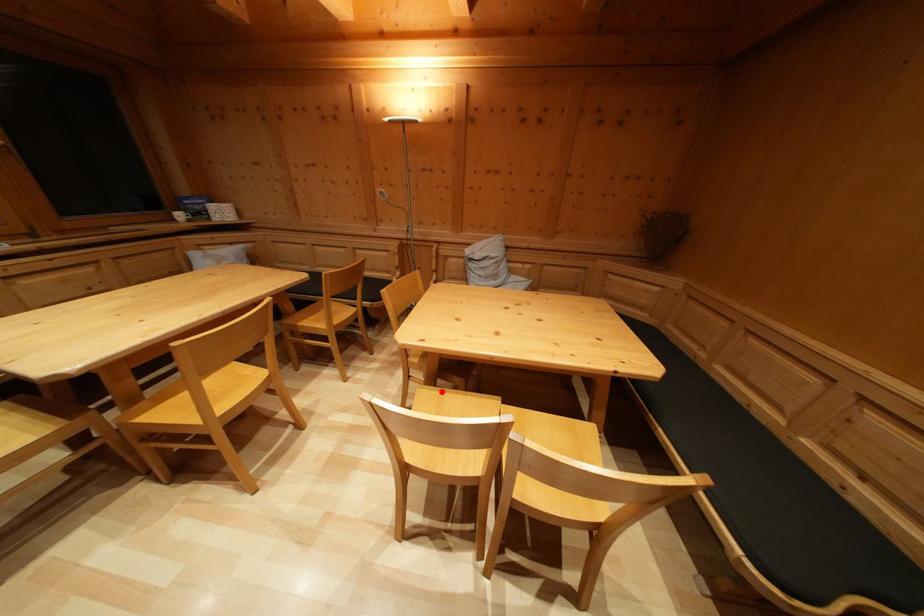
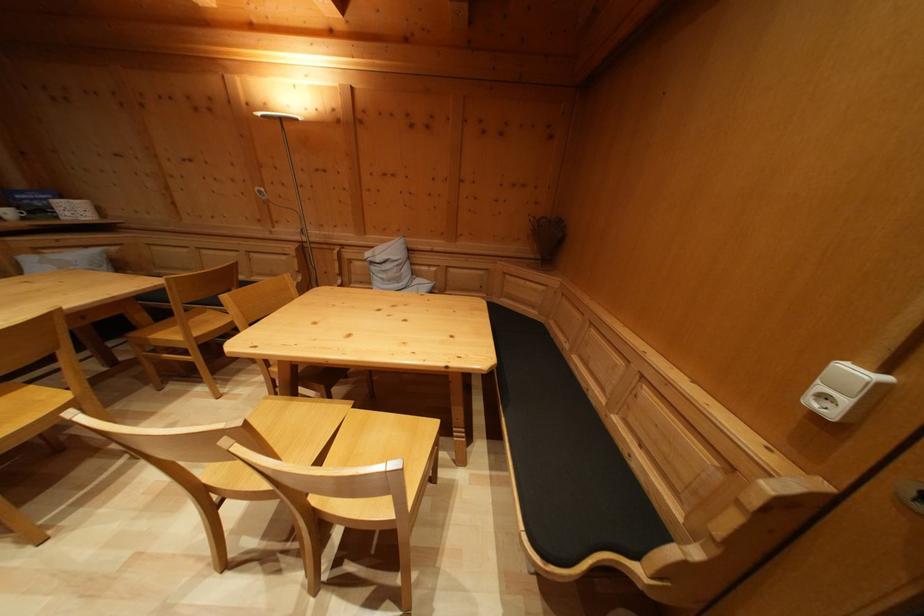
Question: I am providing you with two images of the same scene from different viewpoints. Image1 has a red point marked. In image2, the corresponding 3D location appears at what relative position? Reply with the corresponding letter.

Choices:
 (A) Closer
 (B) Farther

Answer: (A)